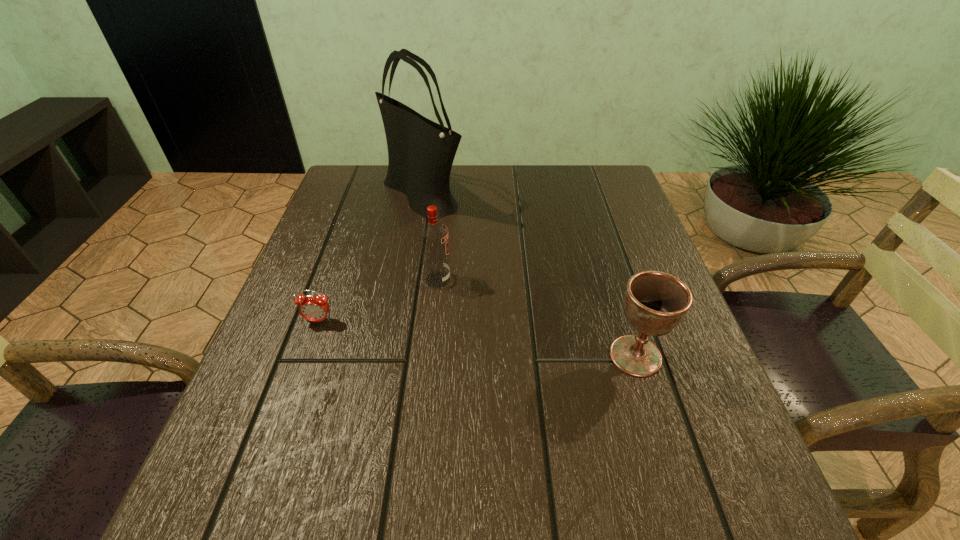
The image size is (960, 540). In the image, there is a desktop. In order to click on vacant space at the far left corner in this screenshot , I will do pos(361,164).

Image resolution: width=960 pixels, height=540 pixels. Find the location of `vacant space at the near left corner`. vacant space at the near left corner is located at coordinates (242, 490).

The height and width of the screenshot is (540, 960). Find the location of `free spot between the third nearest object and the nearest object`. free spot between the third nearest object and the nearest object is located at coordinates (537, 318).

You are a GUI agent. You are given a task and a screenshot of the screen. Output one action in this format:
    pyautogui.click(x=<x>, y=<y>)
    Task: Click on the unoccupied area between the nearest object and the vodka
    This screenshot has width=960, height=540.
    Given the screenshot: What is the action you would take?
    pyautogui.click(x=537, y=318)

I want to click on free point between the second farthest object and the alarm clock, so click(378, 300).

Where is `vacant region between the shoulder bag and the second nearest object`? vacant region between the shoulder bag and the second nearest object is located at coordinates (371, 258).

Where is `free point between the alarm clock and the shoulder bag`? free point between the alarm clock and the shoulder bag is located at coordinates (371, 258).

Where is `vacant space that's between the vodka and the rightmost object`? Image resolution: width=960 pixels, height=540 pixels. vacant space that's between the vodka and the rightmost object is located at coordinates (537, 318).

Image resolution: width=960 pixels, height=540 pixels. What are the coordinates of `vacant space that's between the alarm clock and the chalice` in the screenshot? It's located at (477, 338).

Image resolution: width=960 pixels, height=540 pixels. I want to click on the third closest object relative to the chalice, so click(x=313, y=308).